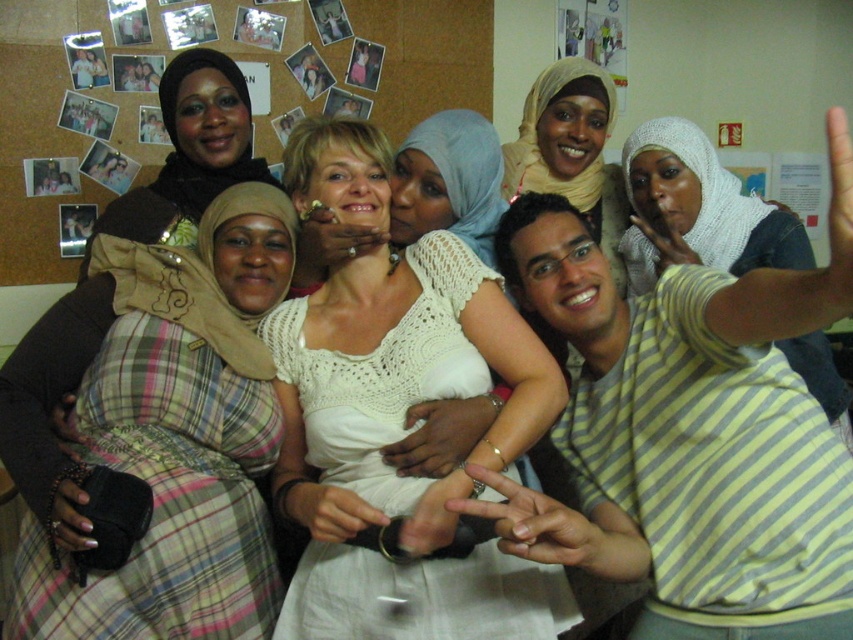
Can you confirm if matte brown scarf at upper left is thinner than smooth skin hand at center?

Incorrect, matte brown scarf at upper left's width is not less than smooth skin hand at center's.

Can you confirm if matte brown scarf at upper left is taller than smooth skin hand at center?

Yes.

This screenshot has height=640, width=853. Describe the element at coordinates (189, 154) in the screenshot. I see `matte brown scarf at upper left` at that location.

Where is `matte brown scarf at upper left`? matte brown scarf at upper left is located at coordinates (189, 154).

At what (x,y) coordinates should I click in order to perform the action: click on yellow striped shirt at center. Please return your answer as a coordinate pair (x, y). The image size is (853, 640). Looking at the image, I should click on (682, 436).

The width and height of the screenshot is (853, 640). What do you see at coordinates (682, 436) in the screenshot?
I see `yellow striped shirt at center` at bounding box center [682, 436].

I want to click on yellow striped shirt at center, so click(x=682, y=436).

The width and height of the screenshot is (853, 640). I want to click on yellow striped shirt at center, so click(682, 436).

Is yellow striped shirt at center shorter than smooth skin hand at center?

Incorrect, yellow striped shirt at center's height does not fall short of smooth skin hand at center's.

What do you see at coordinates (682, 436) in the screenshot? This screenshot has height=640, width=853. I see `yellow striped shirt at center` at bounding box center [682, 436].

I want to click on yellow striped shirt at center, so click(682, 436).